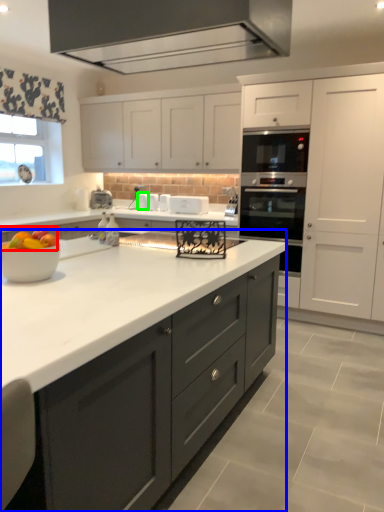
Question: Based on their relative distances, which object is nearer to fruit (highlighted by a red box)? Choose from countertop (highlighted by a blue box) and appliance (highlighted by a green box).

Choices:
 (A) countertop
 (B) appliance

Answer: (A)